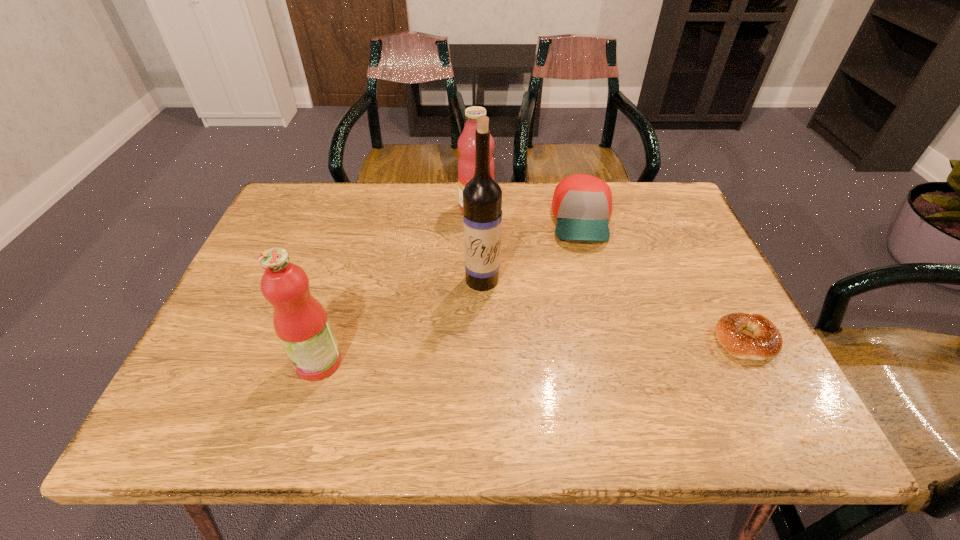
The height and width of the screenshot is (540, 960). Identify the location of free space that is in between the left fruit juice and the bagel. (532, 352).

I want to click on blank region between the leftmost object and the tallest object, so click(x=400, y=321).

At what (x,y) coordinates should I click in order to perform the action: click on free spot between the farther fruit juice and the rightmost object. Please return your answer as a coordinate pair (x, y). This screenshot has height=540, width=960. Looking at the image, I should click on (612, 274).

The width and height of the screenshot is (960, 540). I want to click on object that stands as the closest to the third nearest object, so click(x=582, y=204).

The width and height of the screenshot is (960, 540). I want to click on object identified as the fourth closest to the shortest object, so click(x=300, y=321).